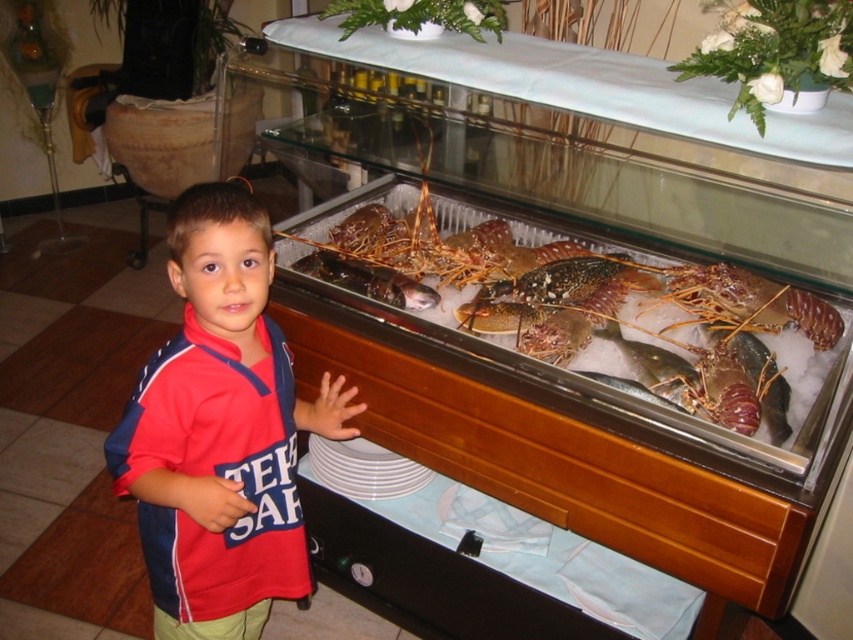
Does wooden drawer at lower center appear on the left side of shiny brown lobster at center?

Yes, wooden drawer at lower center is to the left of shiny brown lobster at center.

Is wooden drawer at lower center above shiny brown lobster at center?

Incorrect, wooden drawer at lower center is not positioned above shiny brown lobster at center.

Who is more forward, (366, 401) or (680, 385)?

Point (680, 385)

The width and height of the screenshot is (853, 640). Identify the location of wooden drawer at lower center. (556, 465).

Which of these two, red cotton shirt at center or shiny silver fish at center, stands taller?

red cotton shirt at center

Does point (126, 492) come farther from viewer compared to point (579, 372)?

No, (126, 492) is closer to viewer.

Find the location of `red cotton shirt at center`. red cotton shirt at center is located at coordinates (219, 432).

Does red cotton shirt at center appear over shiny brown lobster at center?

Actually, red cotton shirt at center is below shiny brown lobster at center.

Who is positioned more to the left, red cotton shirt at center or shiny brown lobster at center?

From the viewer's perspective, red cotton shirt at center appears more on the left side.

Is point (206, 340) less distant than point (689, 365)?

Yes, point (206, 340) is closer to viewer.

Where is `red cotton shirt at center`? red cotton shirt at center is located at coordinates (219, 432).